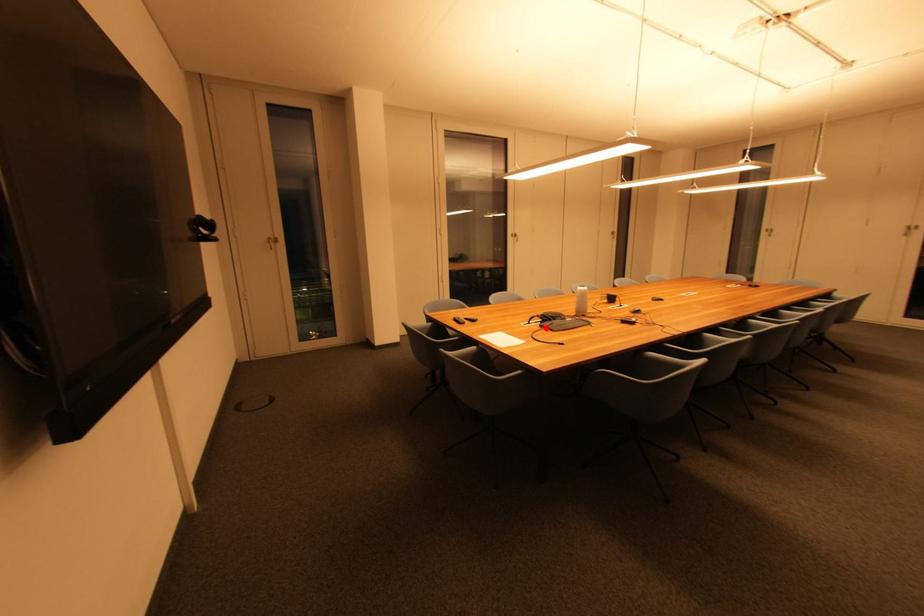
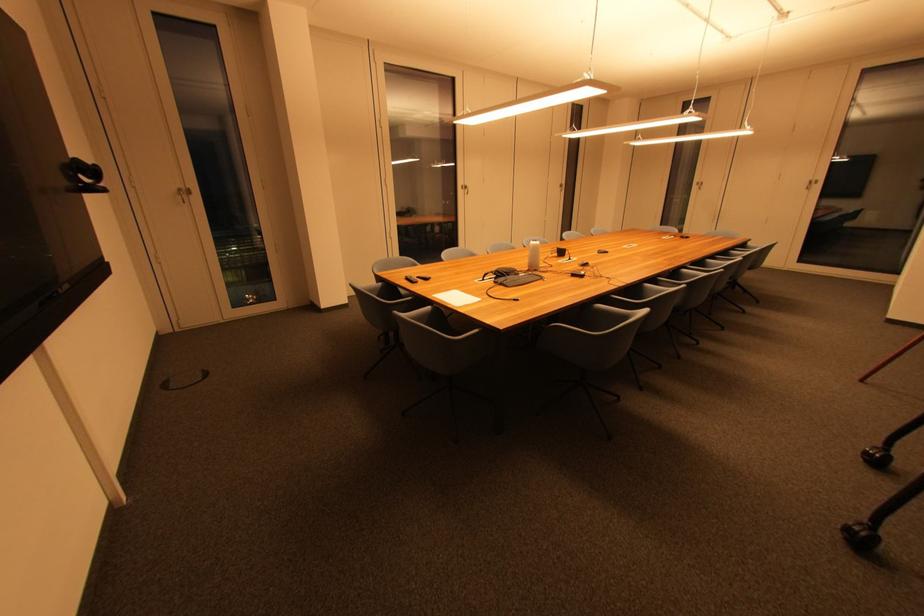
Find the pixel in the second image that matches the highlighted location in the first image.

(500, 285)